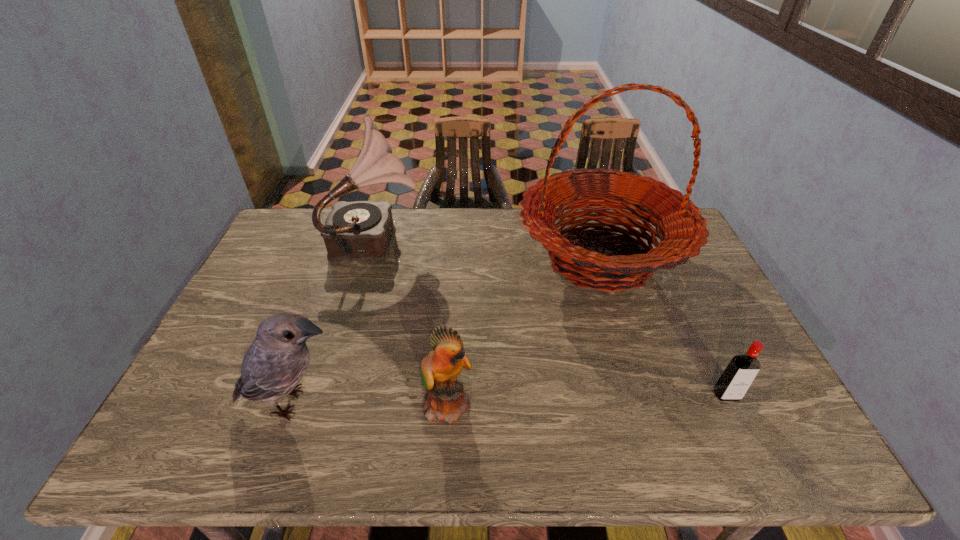
Find the location of a particular element. the tallest object is located at coordinates click(680, 227).

Identify the location of the fourth shortest object. Image resolution: width=960 pixels, height=540 pixels. (361, 230).

Locate an element on the screen. the third object from left to right is located at coordinates (446, 401).

This screenshot has width=960, height=540. I want to click on the left parrot, so click(278, 358).

In order to click on vodka in this screenshot , I will do `click(734, 382)`.

You are a GUI agent. You are given a task and a screenshot of the screen. Output one action in this format:
    pyautogui.click(x=<x>, y=<y>)
    Task: Click on the vacant region located on the left of the basket
    
    Given the screenshot: What is the action you would take?
    pyautogui.click(x=449, y=259)

The height and width of the screenshot is (540, 960). Identify the location of vacant area located 0.170m from the horn of the record player. (474, 239).

The image size is (960, 540). In order to click on free space located on the front-facing side of the third object from left to right in this screenshot , I will do 493,403.

The width and height of the screenshot is (960, 540). I want to click on free location located 0.080m on the front-facing side of the left parrot, so click(381, 403).

At what (x,y) coordinates should I click in order to perform the action: click on free space located on the front and back of the vodka. Please return your answer as a coordinate pair (x, y). The width and height of the screenshot is (960, 540). Looking at the image, I should click on (745, 434).